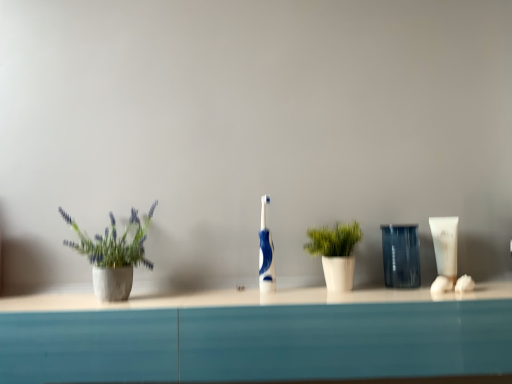
Question: Considering the relative positions of transparent plastic cup at center and white matte tube at right in the image provided, is transparent plastic cup at center to the left of white matte tube at right from the viewer's perspective?

Choices:
 (A) no
 (B) yes

Answer: (B)

Question: From the image's perspective, is transparent plastic cup at center over white matte tube at right?

Choices:
 (A) no
 (B) yes

Answer: (A)

Question: Is transparent plastic cup at center far from white matte tube at right?

Choices:
 (A) no
 (B) yes

Answer: (A)

Question: Considering the relative sizes of transparent plastic cup at center and white matte tube at right in the image provided, is transparent plastic cup at center taller than white matte tube at right?

Choices:
 (A) yes
 (B) no

Answer: (A)

Question: Can you confirm if transparent plastic cup at center is thinner than white matte tube at right?

Choices:
 (A) no
 (B) yes

Answer: (A)

Question: Is transparent plastic cup at center wider than white matte tube at right?

Choices:
 (A) yes
 (B) no

Answer: (A)

Question: Is matte concrete pot at left, which is the first houseplant in left-to-right order, not inside transparent plastic cup at center?

Choices:
 (A) no
 (B) yes

Answer: (B)

Question: Considering the relative sizes of matte concrete pot at left, which is the first houseplant in left-to-right order, and transparent plastic cup at center in the image provided, is matte concrete pot at left, which is the first houseplant in left-to-right order, thinner than transparent plastic cup at center?

Choices:
 (A) yes
 (B) no

Answer: (B)

Question: From a real-world perspective, is matte concrete pot at left, the 2th houseplant when ordered from right to left, over transparent plastic cup at center?

Choices:
 (A) yes
 (B) no

Answer: (A)

Question: Is transparent plastic cup at center at the back of matte concrete pot at left, which is the first houseplant in left-to-right order?

Choices:
 (A) no
 (B) yes

Answer: (A)

Question: Does matte concrete pot at left, which is the first houseplant in left-to-right order, have a smaller size compared to transparent plastic cup at center?

Choices:
 (A) no
 (B) yes

Answer: (A)

Question: Is transparent plastic cup at center inside matte concrete pot at left, which is the first houseplant in left-to-right order?

Choices:
 (A) yes
 (B) no

Answer: (B)

Question: Does blue glossy toothbrush at center have a smaller size compared to white matte plant pot at center, which ranks as the first houseplant in right-to-left order?

Choices:
 (A) yes
 (B) no

Answer: (A)